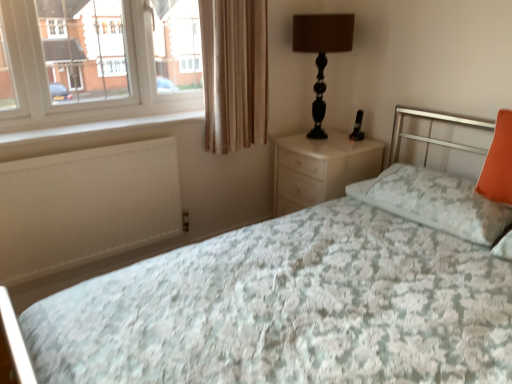
Question: From a real-world perspective, is beige fabric curtain at upper left positioned under white matte radiator at lower left based on gravity?

Choices:
 (A) yes
 (B) no

Answer: (B)

Question: Is beige fabric curtain at upper left thinner than white matte radiator at lower left?

Choices:
 (A) no
 (B) yes

Answer: (B)

Question: Is beige fabric curtain at upper left positioned beyond the bounds of white matte radiator at lower left?

Choices:
 (A) no
 (B) yes

Answer: (B)

Question: Is beige fabric curtain at upper left at the left side of white matte radiator at lower left?

Choices:
 (A) no
 (B) yes

Answer: (A)

Question: Is beige fabric curtain at upper left facing towards white matte radiator at lower left?

Choices:
 (A) yes
 (B) no

Answer: (B)

Question: In the image, is beige fabric curtain at upper left positioned in front of or behind white matte radiator at lower left?

Choices:
 (A) front
 (B) behind

Answer: (B)

Question: Is point (220, 145) positioned closer to the camera than point (68, 231)?

Choices:
 (A) closer
 (B) farther

Answer: (B)

Question: Looking at their shapes, would you say beige fabric curtain at upper left is wider or thinner than white matte radiator at lower left?

Choices:
 (A) wide
 (B) thin

Answer: (A)

Question: In the image, is beige fabric curtain at upper left on the left side or the right side of white matte radiator at lower left?

Choices:
 (A) right
 (B) left

Answer: (A)

Question: Is point (468, 215) positioned closer to the camera than point (129, 147)?

Choices:
 (A) farther
 (B) closer

Answer: (B)

Question: Considering the relative positions of orange fabric pillow at right, which is the 1th pillow in left-to-right order, and white matte radiator at lower left in the image provided, is orange fabric pillow at right, which is the 1th pillow in left-to-right order, to the left or to the right of white matte radiator at lower left?

Choices:
 (A) left
 (B) right

Answer: (B)

Question: Is orange fabric pillow at right, the 2th pillow when ordered from right to left, taller or shorter than white matte radiator at lower left?

Choices:
 (A) tall
 (B) short

Answer: (B)

Question: In terms of width, does orange fabric pillow at right, the 2th pillow when ordered from right to left, look wider or thinner when compared to white matte radiator at lower left?

Choices:
 (A) wide
 (B) thin

Answer: (A)

Question: Considering the positions of white matte radiator at lower left and floral fabric bed at center in the image, is white matte radiator at lower left wider or thinner than floral fabric bed at center?

Choices:
 (A) thin
 (B) wide

Answer: (A)

Question: Looking at the image, does white matte radiator at lower left seem bigger or smaller compared to floral fabric bed at center?

Choices:
 (A) big
 (B) small

Answer: (B)